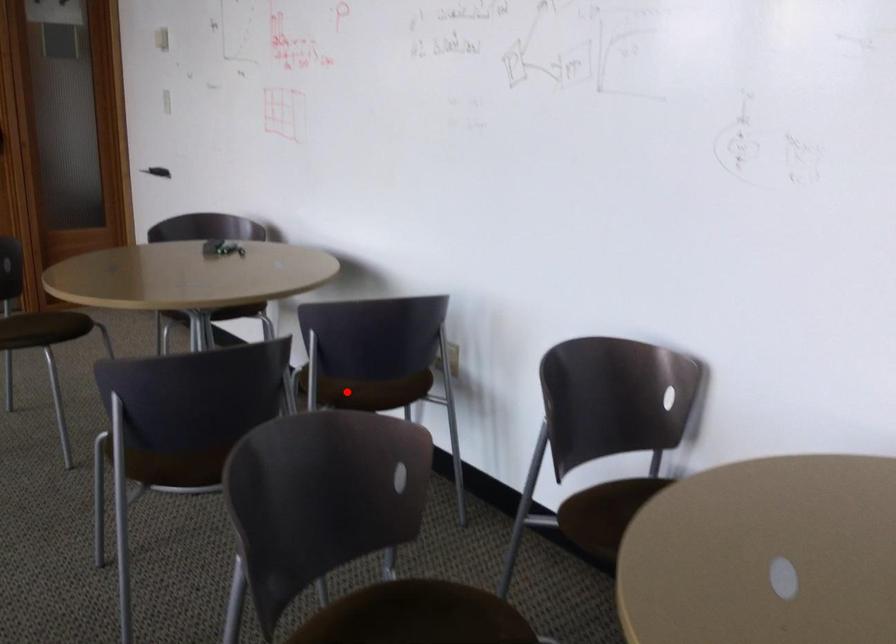
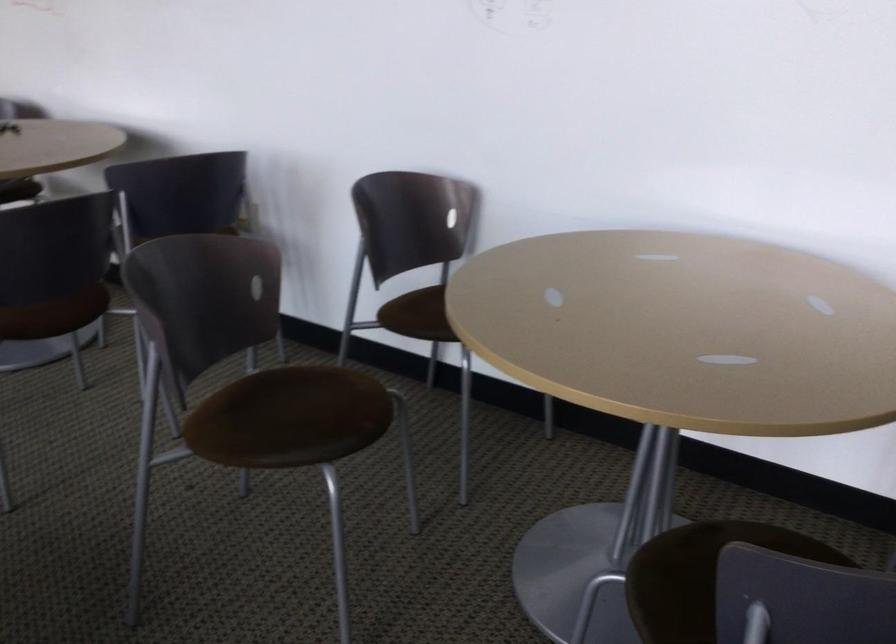
Question: I am providing you with two images of the same scene from different viewpoints. A red point is marked on the first image. At the location where the point appears in image 1, is it still visible in image 2?

Choices:
 (A) Yes
 (B) No

Answer: (B)